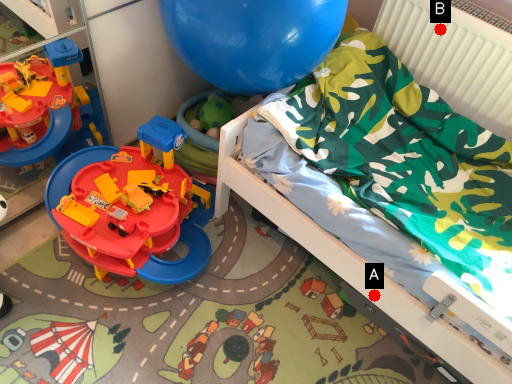
Question: Two points are circled on the image, labeled by A and B beside each circle. Which of the following is the closest to the observer?

Choices:
 (A) A is closer
 (B) B is closer

Answer: (A)